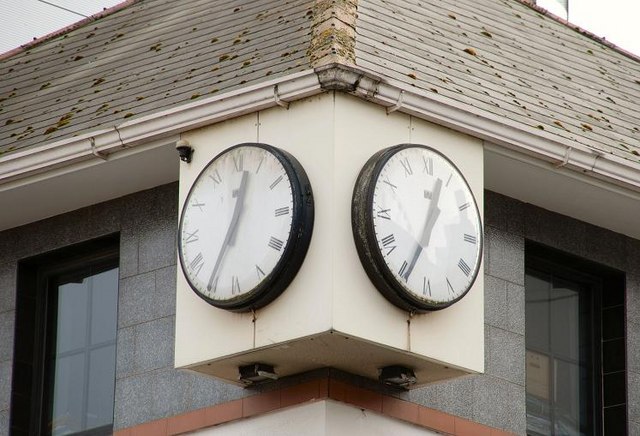
Where is `2 windows`? This screenshot has height=436, width=640. 2 windows is located at coordinates (576, 384), (77, 343).